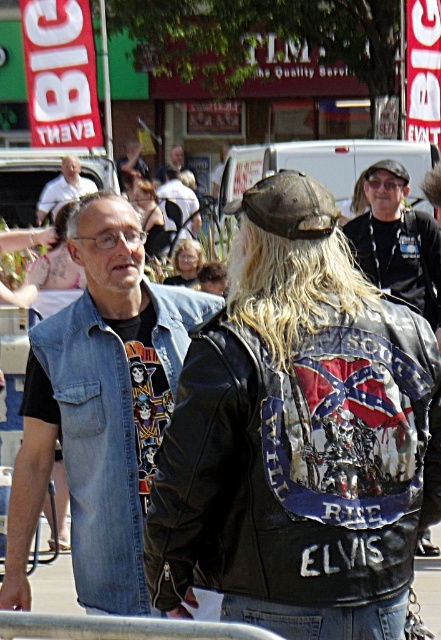
Question: Which object is closer to the camera taking this photo?

Choices:
 (A) blonde hair at center
 (B) denim jacket at left

Answer: (B)

Question: Based on their relative distances, which object is farther from the matte black hair at upper center?

Choices:
 (A) gray hair at center
 (B) black leather jacket at upper right
 (C) white leather jacket at center
 (D) blondehair at center

Answer: (D)

Question: Can you confirm if black leather jacket at center is positioned below light brown leather jacket at center?

Choices:
 (A) yes
 (B) no

Answer: (A)

Question: Which of these objects is positioned farthest from the white leather jacket at center?

Choices:
 (A) denim jacket at left
 (B) black leather jacket at center
 (C) gray hair at center

Answer: (B)

Question: Is denim jacket at left in front of blonde hair at center?

Choices:
 (A) yes
 (B) no

Answer: (A)

Question: Does blonde hair at center lie in front of light brown leather jacket at center?

Choices:
 (A) yes
 (B) no

Answer: (A)